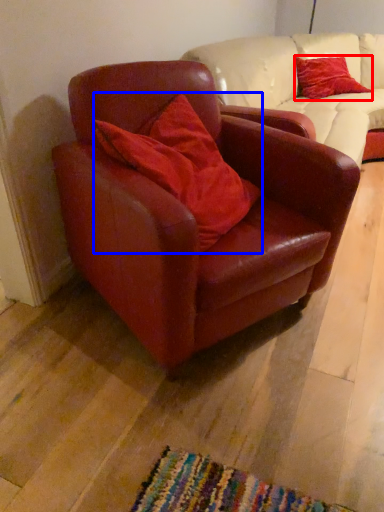
Question: Which point is further to the camera, pillow (highlighted by a red box) or pillow (highlighted by a blue box)?

Choices:
 (A) pillow
 (B) pillow

Answer: (A)